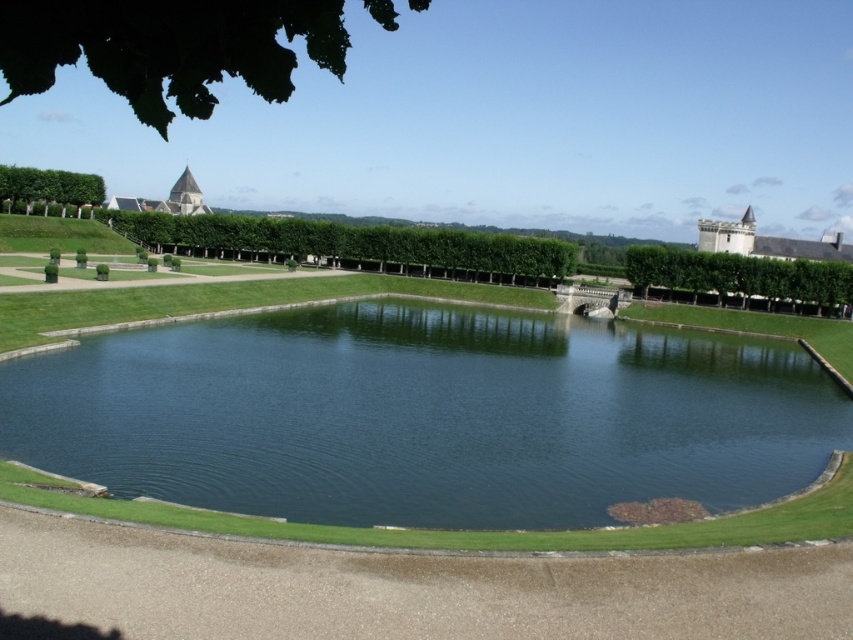
Is point (194, 403) positioned before point (288, 218)?

Yes, point (194, 403) is closer to viewer.

Between green smooth water at center and green leafy hedge at center, which one appears on the right side from the viewer's perspective?

green smooth water at center is more to the right.

Does point (792, 445) come farther from viewer compared to point (315, 253)?

No, it is not.

The width and height of the screenshot is (853, 640). Identify the location of green smooth water at center. (425, 417).

Which is more to the right, green smooth water at center or smooth stone tower at upper left?

Positioned to the right is green smooth water at center.

Find the location of a particular element. The width and height of the screenshot is (853, 640). green smooth water at center is located at coordinates (425, 417).

Image resolution: width=853 pixels, height=640 pixels. What do you see at coordinates (425, 417) in the screenshot?
I see `green smooth water at center` at bounding box center [425, 417].

The image size is (853, 640). What are the coordinates of `green smooth water at center` in the screenshot? It's located at (425, 417).

Does green smooth water at center have a larger size compared to green leafy hedge at upper left?

Indeed, green smooth water at center has a larger size compared to green leafy hedge at upper left.

The width and height of the screenshot is (853, 640). In order to click on green smooth water at center in this screenshot , I will do `click(425, 417)`.

Where is `green smooth water at center`? The height and width of the screenshot is (640, 853). green smooth water at center is located at coordinates (425, 417).